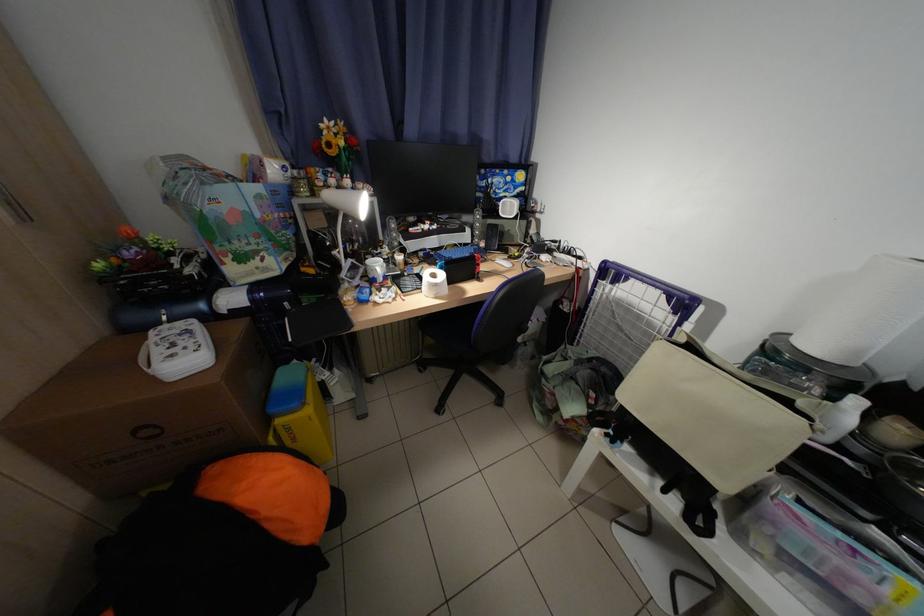
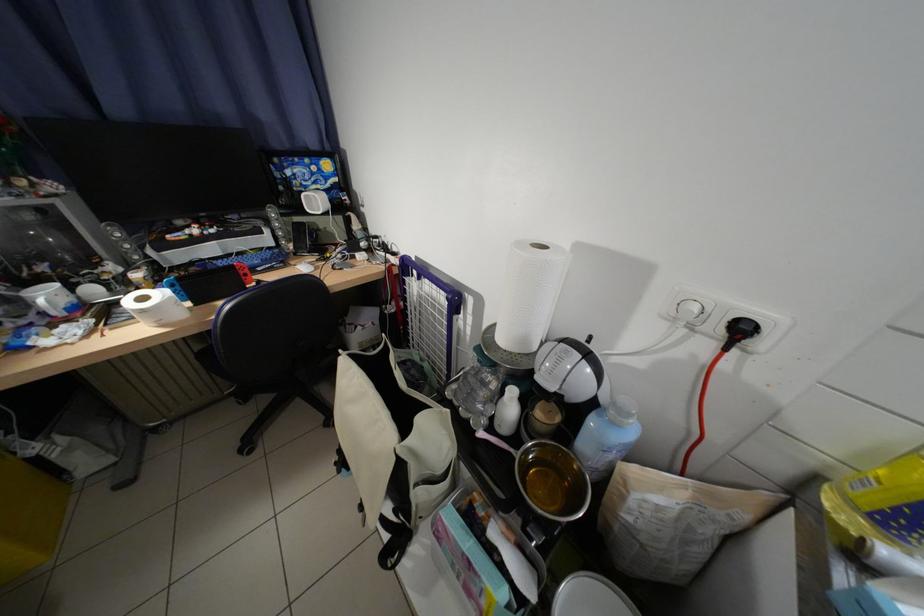
Where in the second image is the point corresponding to (x=388, y=267) from the first image?

(59, 297)